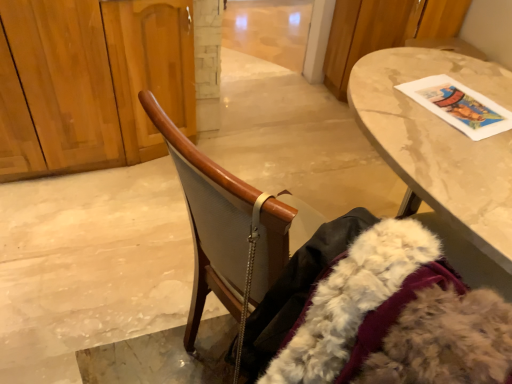
Question: From a real-world perspective, is wooden chair at center beneath wooden dresser at left?

Choices:
 (A) yes
 (B) no

Answer: (B)

Question: From the image's perspective, is wooden chair at center under wooden dresser at left?

Choices:
 (A) yes
 (B) no

Answer: (A)

Question: Does wooden chair at center have a lesser height compared to wooden dresser at left?

Choices:
 (A) yes
 (B) no

Answer: (A)

Question: Is wooden chair at center completely or partially outside of wooden dresser at left?

Choices:
 (A) yes
 (B) no

Answer: (A)

Question: Is wooden chair at center further to the viewer compared to wooden dresser at left?

Choices:
 (A) no
 (B) yes

Answer: (A)

Question: Looking at the image, does marble table at upper right seem bigger or smaller compared to white fluffy fur coat at lower right?

Choices:
 (A) small
 (B) big

Answer: (B)

Question: From the image's perspective, is marble table at upper right above or below white fluffy fur coat at lower right?

Choices:
 (A) above
 (B) below

Answer: (A)

Question: Which is correct: marble table at upper right is inside white fluffy fur coat at lower right, or outside of it?

Choices:
 (A) outside
 (B) inside

Answer: (A)

Question: In the image, is marble table at upper right positioned in front of or behind white fluffy fur coat at lower right?

Choices:
 (A) front
 (B) behind

Answer: (B)

Question: From the image's perspective, is marble table at upper right located above or below wooden dresser at left?

Choices:
 (A) below
 (B) above

Answer: (A)

Question: In the image, is marble table at upper right positioned in front of or behind wooden dresser at left?

Choices:
 (A) behind
 (B) front

Answer: (B)

Question: Is marble table at upper right wider or thinner than wooden dresser at left?

Choices:
 (A) thin
 (B) wide

Answer: (B)

Question: Visually, is marble table at upper right positioned to the left or to the right of wooden dresser at left?

Choices:
 (A) right
 (B) left

Answer: (A)

Question: Do you think marble table at upper right is within wooden chair at center, or outside of it?

Choices:
 (A) inside
 (B) outside

Answer: (B)

Question: In the image, is marble table at upper right positioned in front of or behind wooden chair at center?

Choices:
 (A) front
 (B) behind

Answer: (B)